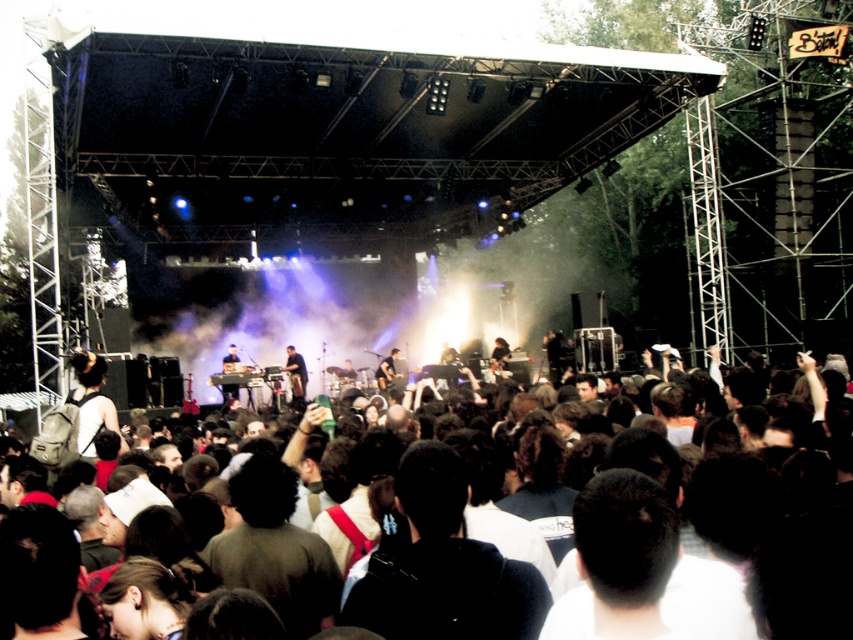
Does dark brown hair at center appear over dark brown leather guitar at center?

Incorrect, dark brown hair at center is not positioned above dark brown leather guitar at center.

Who is taller, dark brown hair at center or dark brown leather guitar at center?

dark brown hair at center is taller.

What do you see at coordinates (445, 554) in the screenshot? I see `dark brown hair at center` at bounding box center [445, 554].

Locate an element on the screen. dark brown hair at center is located at coordinates (445, 554).

Does dark brown hair at center come behind metallic keyboard at center?

No.

Between dark brown hair at center and metallic keyboard at center, which one appears on the left side from the viewer's perspective?

From the viewer's perspective, metallic keyboard at center appears more on the left side.

The height and width of the screenshot is (640, 853). What do you see at coordinates (445, 554) in the screenshot? I see `dark brown hair at center` at bounding box center [445, 554].

Locate an element on the screen. The image size is (853, 640). dark brown hair at center is located at coordinates (445, 554).

Is metallic keyboard at center to the right of dark brown leather guitar at center from the viewer's perspective?

Incorrect, metallic keyboard at center is not on the right side of dark brown leather guitar at center.

Between point (231, 358) and point (390, 371), which one is positioned in front?

Point (231, 358) is more forward.

This screenshot has width=853, height=640. I want to click on metallic keyboard at center, so pos(231,358).